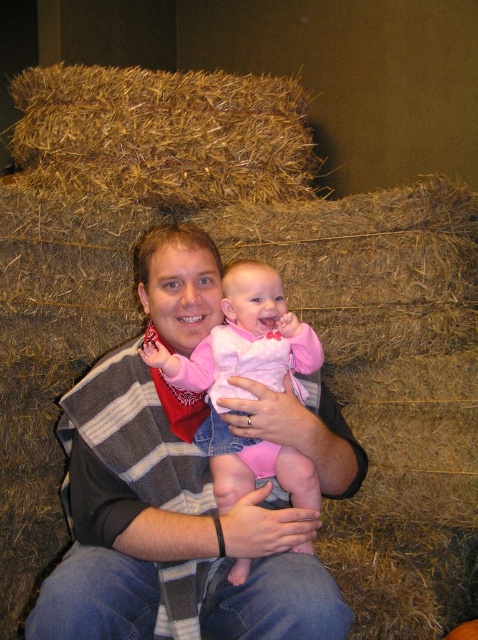
What is the exact coordinate of the striped wool sweater at center?

The striped wool sweater at center is located at point (x=170, y=531).

You are taking a photo of the scene and want to focus on both the man and the baby. The man is at point (170, 452) and the baby is at point (259, 326). Which point should you adjust your focus to first to ensure both are in focus?

You should focus on point (259, 326) first because it is farther from the camera than point (170, 452). By focusing on the farther point, the closer point will also be within the depth of field, ensuring both are in focus.